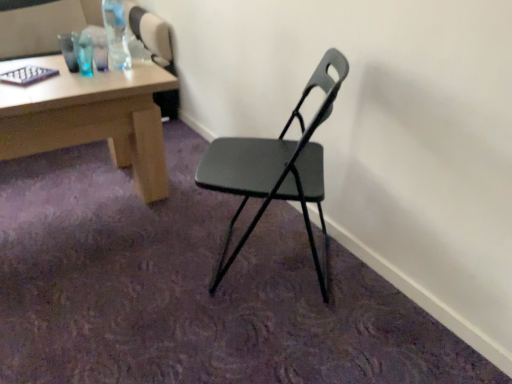
Locate an element on the screen. This screenshot has width=512, height=384. blank space to the left of matte black chair at center is located at coordinates (146, 261).